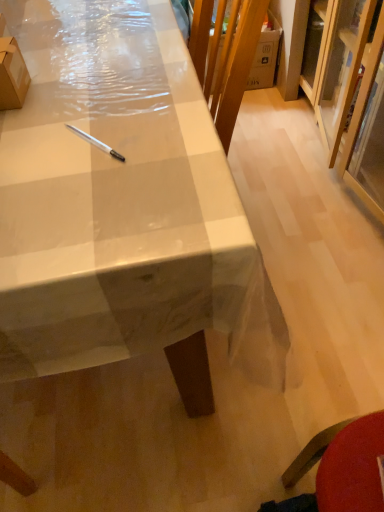
Locate an element on the screen. vacant area on top of white glossy desk at center (from a real-world perspective) is located at coordinates (72, 86).